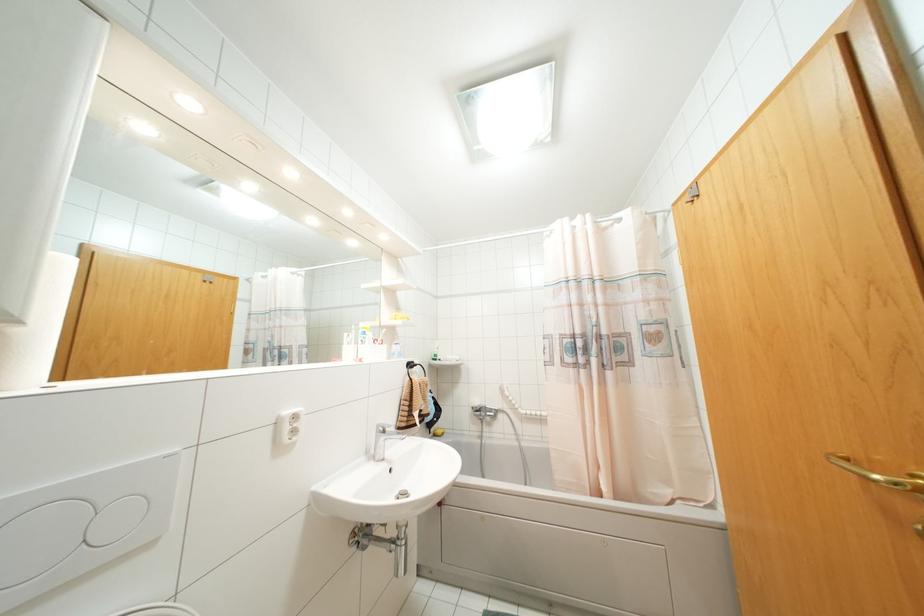
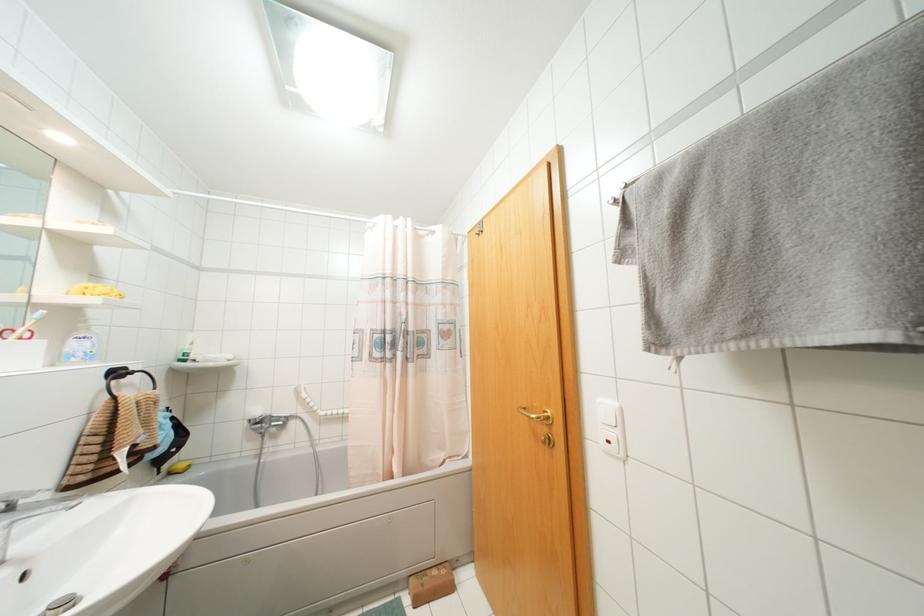
In the second image, find the point that corresponds to point 434,435 in the first image.

(169, 472)